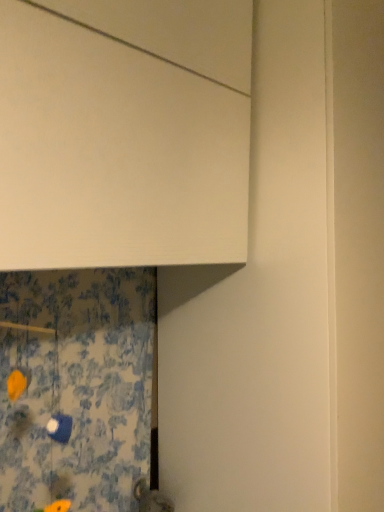
The image size is (384, 512). Describe the element at coordinates (124, 132) in the screenshot. I see `white matte cabinet at upper center` at that location.

In order to face white matte cabinet at upper center, should I rotate leftwards or rightwards?

Turn left by 12.238 degrees to look at white matte cabinet at upper center.

What is the approximate width of white matte cabinet at upper center?

white matte cabinet at upper center is 20.74 inches wide.

Image resolution: width=384 pixels, height=512 pixels. I want to click on white matte cabinet at upper center, so click(x=124, y=132).

Identify the location of blue floral fabric at lower left. (76, 386).

What do you see at coordinates (76, 386) in the screenshot?
I see `blue floral fabric at lower left` at bounding box center [76, 386].

Identify the location of white matte cabinet at upper center. (124, 132).

Based on their positions, is blue floral fabric at lower left located to the left or right of white matte cabinet at upper center?

blue floral fabric at lower left is to the left of white matte cabinet at upper center.

Between blue floral fabric at lower left and white matte cabinet at upper center, which one is positioned behind?

white matte cabinet at upper center is more distant.

Considering the positions of point (39, 407) and point (144, 149), is point (39, 407) closer or farther from the camera than point (144, 149)?

Clearly, point (39, 407) is more distant from the camera than point (144, 149).

From the image's perspective, would you say blue floral fabric at lower left is shown under white matte cabinet at upper center?

Yes.

From a real-world perspective, does blue floral fabric at lower left sit lower than white matte cabinet at upper center?

Result: Yes, from a real-world perspective, blue floral fabric at lower left is below white matte cabinet at upper center.

Which object is wider, blue floral fabric at lower left or white matte cabinet at upper center?

Wider between the two is white matte cabinet at upper center.

Which of these two, blue floral fabric at lower left or white matte cabinet at upper center, stands shorter?

blue floral fabric at lower left.

Who is smaller, blue floral fabric at lower left or white matte cabinet at upper center?

blue floral fabric at lower left.

Is blue floral fabric at lower left surrounding white matte cabinet at upper center?

No, white matte cabinet at upper center is not surrounded by blue floral fabric at lower left.

Is blue floral fabric at lower left next to white matte cabinet at upper center and touching it?

No.

Could you tell me if blue floral fabric at lower left is facing white matte cabinet at upper center?

No.

Find the location of a particular element. shower curtain in front of the white matte cabinet at upper center is located at coordinates (76, 386).

Can you confirm if white matte cabinet at upper center is positioned to the right of blue floral fabric at lower left?

Yes, white matte cabinet at upper center is to the right of blue floral fabric at lower left.

Considering their positions, is white matte cabinet at upper center located in front of or behind blue floral fabric at lower left?

In the image, white matte cabinet at upper center appears behind blue floral fabric at lower left.

Is point (109, 227) farther from viewer compared to point (110, 375)?

No, (109, 227) is in front of (110, 375).

From the image's perspective, is white matte cabinet at upper center above or below blue floral fabric at lower left?

white matte cabinet at upper center is above blue floral fabric at lower left.

Looking at this image, from a real-world perspective, is white matte cabinet at upper center physically above blue floral fabric at lower left?

Yes.

Is white matte cabinet at upper center wider than blue floral fabric at lower left?

Yes, white matte cabinet at upper center is wider than blue floral fabric at lower left.

Considering the sizes of objects white matte cabinet at upper center and blue floral fabric at lower left in the image provided, who is shorter, white matte cabinet at upper center or blue floral fabric at lower left?

Standing shorter between the two is blue floral fabric at lower left.

Who is bigger, white matte cabinet at upper center or blue floral fabric at lower left?

white matte cabinet at upper center is bigger.

Looking at this image, can blue floral fabric at lower left be found inside white matte cabinet at upper center?

No, blue floral fabric at lower left is located outside of white matte cabinet at upper center.

Would you say white matte cabinet at upper center is a long distance from blue floral fabric at lower left?

No, there isn't a large distance between white matte cabinet at upper center and blue floral fabric at lower left.

Is white matte cabinet at upper center oriented towards blue floral fabric at lower left?

No, white matte cabinet at upper center is not oriented towards blue floral fabric at lower left.

Measure the distance between white matte cabinet at upper center and blue floral fabric at lower left.

They are 20.54 inches apart.

The height and width of the screenshot is (512, 384). Find the location of `cabinetry positioned vertically above the blue floral fabric at lower left (from a real-world perspective)`. cabinetry positioned vertically above the blue floral fabric at lower left (from a real-world perspective) is located at coordinates (124, 132).

This screenshot has height=512, width=384. I want to click on cabinetry on the right of blue floral fabric at lower left, so click(124, 132).

Locate an element on the screen. The width and height of the screenshot is (384, 512). shower curtain to the left of white matte cabinet at upper center is located at coordinates (76, 386).